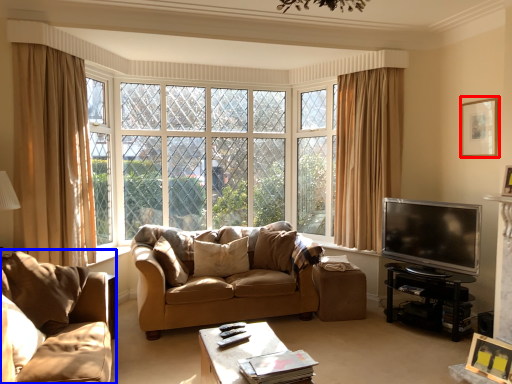
Question: Among these objects, which one is farthest to the camera, picture frame (highlighted by a red box) or studio couch (highlighted by a blue box)?

Choices:
 (A) picture frame
 (B) studio couch

Answer: (A)